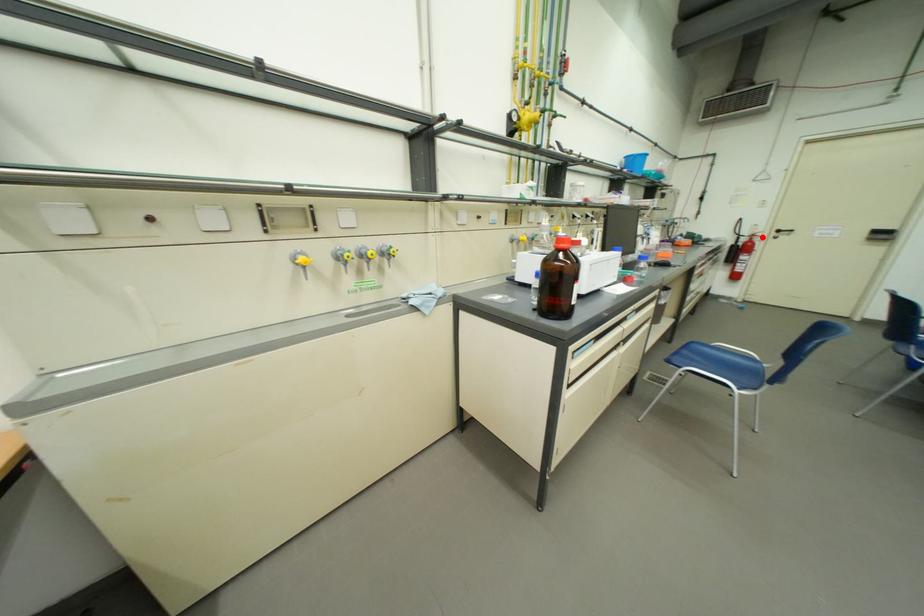
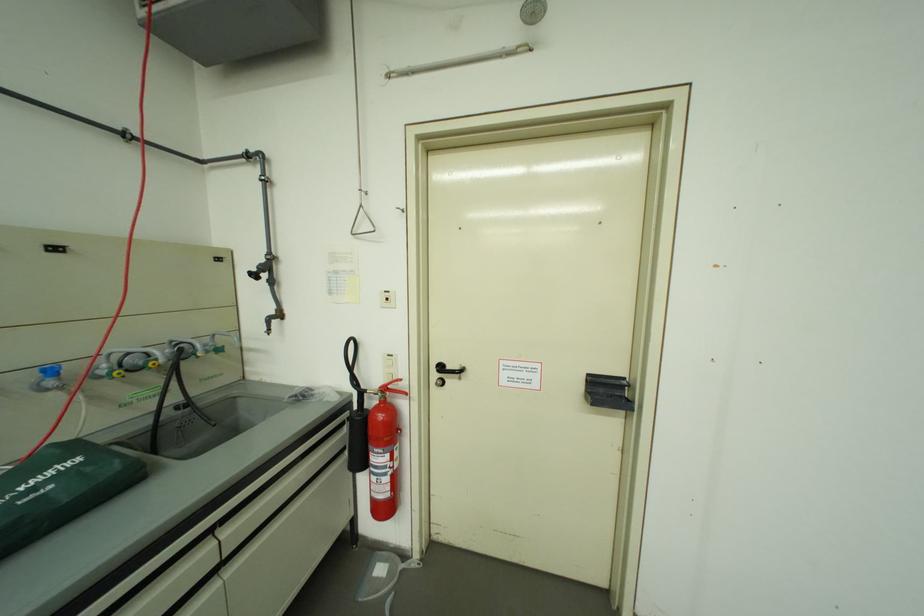
Locate, in the second image, the point that corresponds to the highlighted location in the first image.

(394, 391)